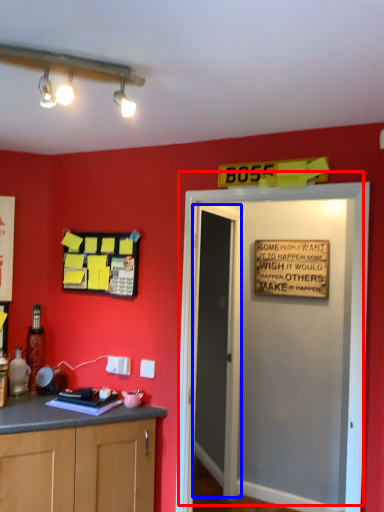
Question: Which of the following is the closest to the observer, door (highlighted by a red box) or door (highlighted by a blue box)?

Choices:
 (A) door
 (B) door

Answer: (A)